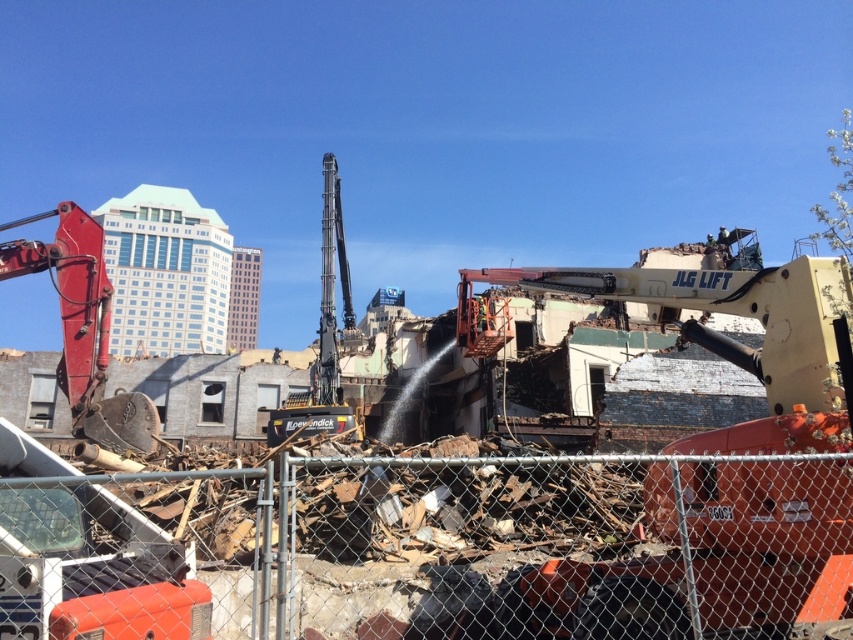
Question: Is yellow metallic excavator at center bigger than black metallic excavator at center?

Choices:
 (A) yes
 (B) no

Answer: (B)

Question: Is yellow metallic excavator at center smaller than matte red excavator at left?

Choices:
 (A) no
 (B) yes

Answer: (B)

Question: Which of the following is the farthest from the observer?

Choices:
 (A) matte red excavator at left
 (B) yellow metallic excavator at center
 (C) metal chain-link fence at center

Answer: (A)

Question: Which point appears farthest from the camera in this image?

Choices:
 (A) (9, 273)
 (B) (231, 630)
 (C) (763, 522)
 (D) (322, 362)

Answer: (D)

Question: Among these points, which one is nearest to the camera?

Choices:
 (A) (654, 561)
 (B) (337, 244)
 (C) (93, 518)
 (D) (65, 241)

Answer: (C)

Question: Is yellow metallic excavator at center smaller than matte red excavator at left?

Choices:
 (A) yes
 (B) no

Answer: (A)